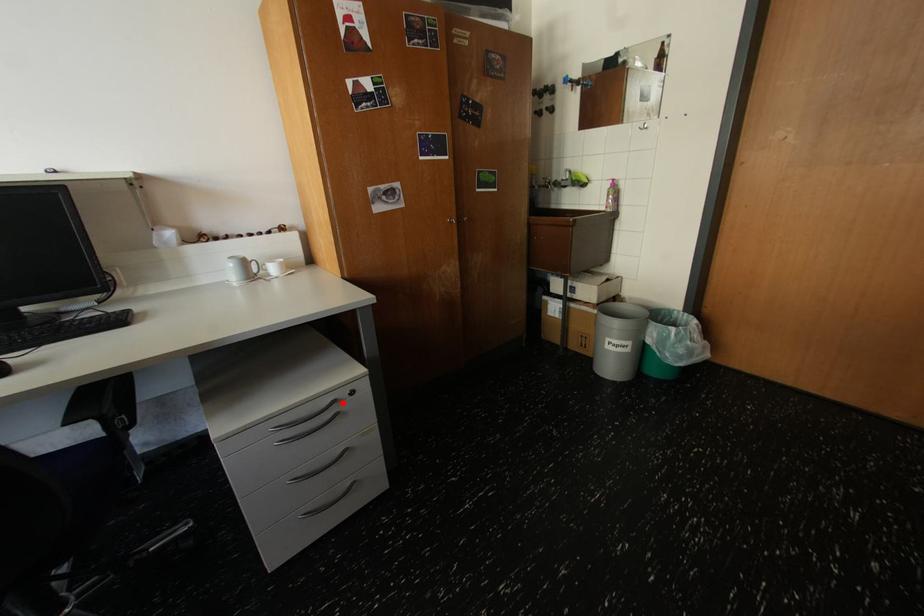
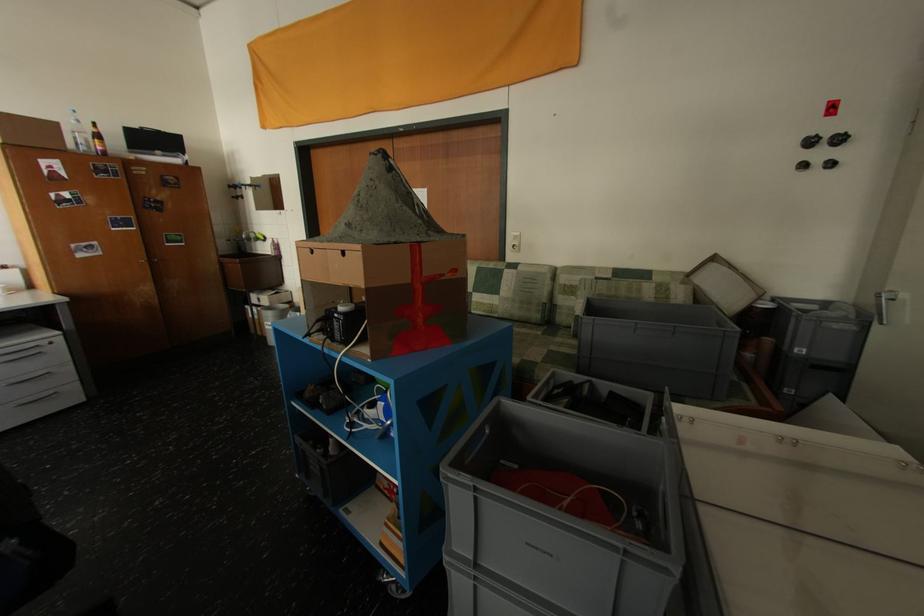
Locate, in the second image, the point that corresponds to the highlighted location in the first image.

(45, 347)